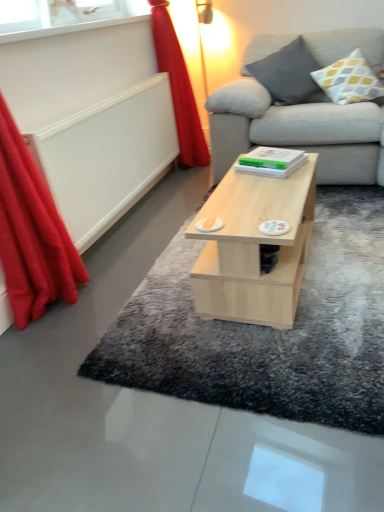
Question: From the image's perspective, is light wood coffee table at center under yellow and gray dotted pillow at upper right, acting as the 1th pillow starting from the right?

Choices:
 (A) no
 (B) yes

Answer: (B)

Question: Does light wood coffee table at center appear on the right side of yellow and gray dotted pillow at upper right, placed as the second pillow when sorted from left to right?

Choices:
 (A) yes
 (B) no

Answer: (B)

Question: Considering the relative sizes of light wood coffee table at center and yellow and gray dotted pillow at upper right, placed as the second pillow when sorted from left to right, in the image provided, is light wood coffee table at center smaller than yellow and gray dotted pillow at upper right, placed as the second pillow when sorted from left to right,?

Choices:
 (A) yes
 (B) no

Answer: (B)

Question: Is yellow and gray dotted pillow at upper right, placed as the second pillow when sorted from left to right, completely or partially inside light wood coffee table at center?

Choices:
 (A) yes
 (B) no

Answer: (B)

Question: From the image's perspective, would you say light wood coffee table at center is positioned over yellow and gray dotted pillow at upper right, placed as the second pillow when sorted from left to right?

Choices:
 (A) yes
 (B) no

Answer: (B)

Question: Does light wood coffee table at center lie behind yellow and gray dotted pillow at upper right, placed as the second pillow when sorted from left to right?

Choices:
 (A) no
 (B) yes

Answer: (A)

Question: Can you confirm if gray fabric pillow at upper right, the second pillow positioned from the right, is wider than red fabric curtain at left, which is the 1th curtain from front to back?

Choices:
 (A) yes
 (B) no

Answer: (A)

Question: Is gray fabric pillow at upper right, the first pillow in the left-to-right sequence, in front of red fabric curtain at left, which ranks as the 2th curtain in right-to-left order?

Choices:
 (A) yes
 (B) no

Answer: (B)

Question: Is gray fabric pillow at upper right, the first pillow in the left-to-right sequence, at the right side of red fabric curtain at left, which ranks as the 2th curtain in right-to-left order?

Choices:
 (A) no
 (B) yes

Answer: (B)

Question: Can you confirm if gray fabric pillow at upper right, the second pillow positioned from the right, is thinner than red fabric curtain at left, placed as the first curtain when sorted from left to right?

Choices:
 (A) no
 (B) yes

Answer: (A)

Question: From the image's perspective, is gray fabric pillow at upper right, the second pillow positioned from the right, on red fabric curtain at left, which ranks as the 2th curtain in right-to-left order?

Choices:
 (A) no
 (B) yes

Answer: (B)

Question: From a real-world perspective, does gray fabric pillow at upper right, the first pillow in the left-to-right sequence, stand above red fabric curtain at left, placed as the first curtain when sorted from left to right?

Choices:
 (A) no
 (B) yes

Answer: (B)

Question: Considering the relative positions of red velvet curtain at left, which is counted as the second curtain, starting from the front, and red fabric curtain at left, which is the 1th curtain from front to back, in the image provided, is red velvet curtain at left, which is counted as the second curtain, starting from the front, behind red fabric curtain at left, which is the 1th curtain from front to back,?

Choices:
 (A) no
 (B) yes

Answer: (B)